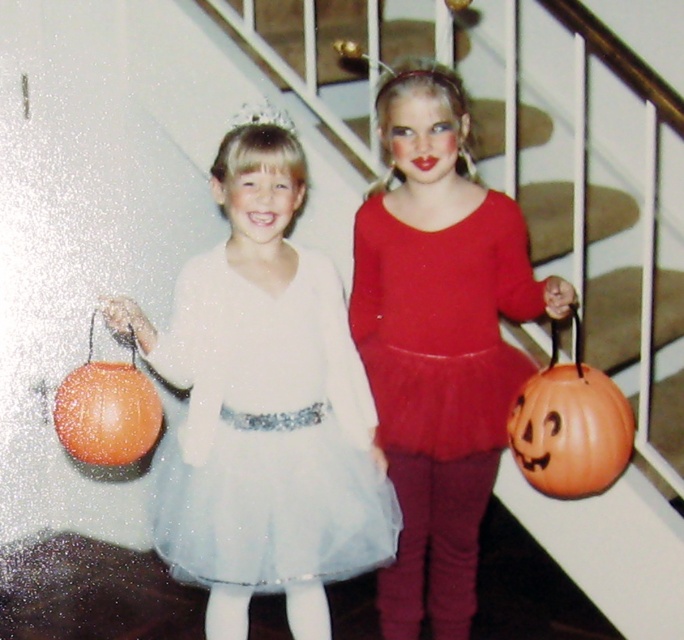
Who is shorter, matte red dress at center or orange matte pumpkin at right?

orange matte pumpkin at right is shorter.

From the picture: Is matte red dress at center in front of orange matte pumpkin at right?

That is False.

Is point (412, 339) positioned in front of point (573, 316)?

No, (412, 339) is further to viewer.

Find the location of a particular element. Image resolution: width=684 pixels, height=640 pixels. matte red dress at center is located at coordinates (438, 340).

Between orange matte pumpkin at right and orange matte pumpkin at left, which one has more height?

orange matte pumpkin at right

Can you confirm if orange matte pumpkin at right is shorter than orange matte pumpkin at left?

No.

Is point (575, 394) positioned after point (78, 394)?

No, (575, 394) is in front of (78, 394).

This screenshot has width=684, height=640. Find the location of `orange matte pumpkin at right`. orange matte pumpkin at right is located at coordinates [x=570, y=426].

Can you confirm if red tulle dress at center is smaller than orange matte pumpkin at right?

Actually, red tulle dress at center might be larger than orange matte pumpkin at right.

What do you see at coordinates (440, 324) in the screenshot?
I see `red tulle dress at center` at bounding box center [440, 324].

Between point (453, 236) and point (557, 490), which one is positioned in front?

Point (557, 490)

Where is `red tulle dress at center`? This screenshot has width=684, height=640. red tulle dress at center is located at coordinates (440, 324).